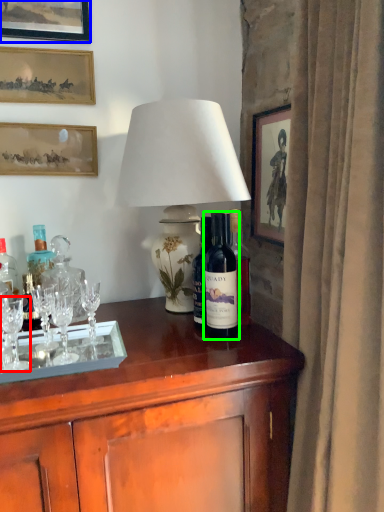
Question: Based on their relative distances, which object is nearer to wine glass (highlighted by a red box)? Choose from picture frame (highlighted by a blue box) and bottle (highlighted by a green box).

Choices:
 (A) picture frame
 (B) bottle

Answer: (B)